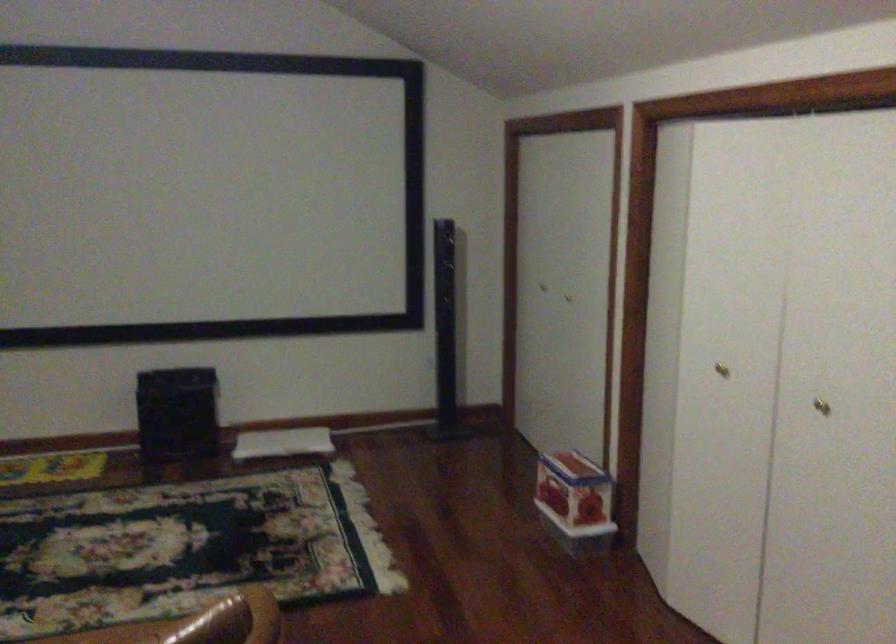
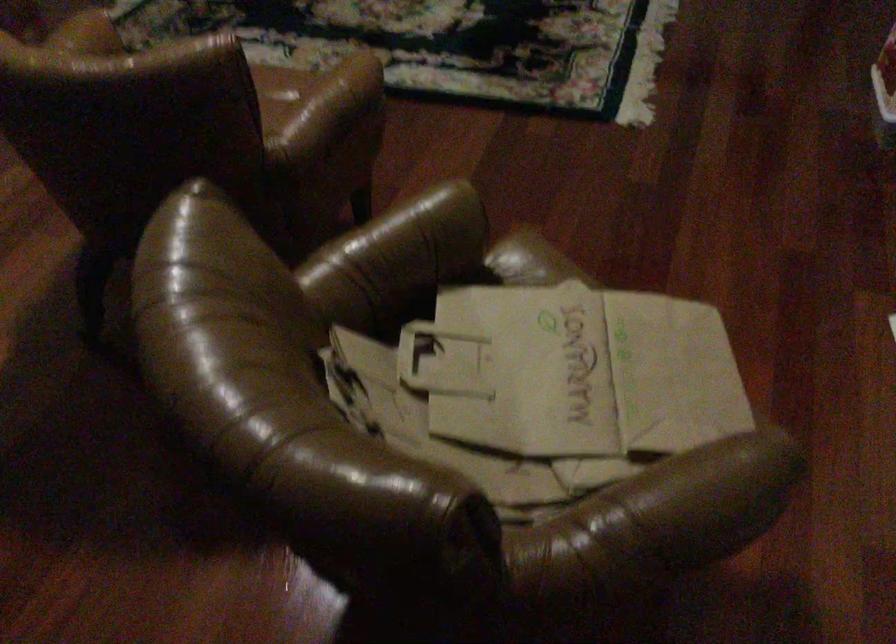
The first image is from the beginning of the video and the second image is from the end. How did the camera likely rotate when shooting the video?

The camera rotated toward left-down.